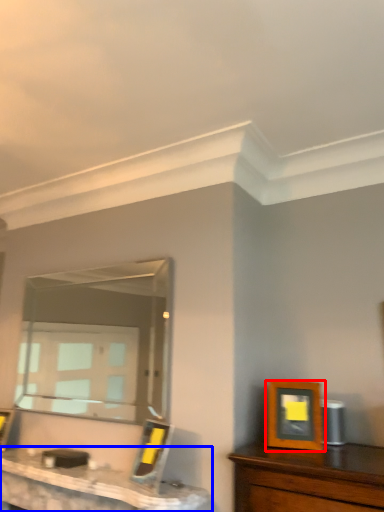
Question: Which point is closer to the camera, picture frame (highlighted by a red box) or table (highlighted by a blue box)?

Choices:
 (A) picture frame
 (B) table

Answer: (B)